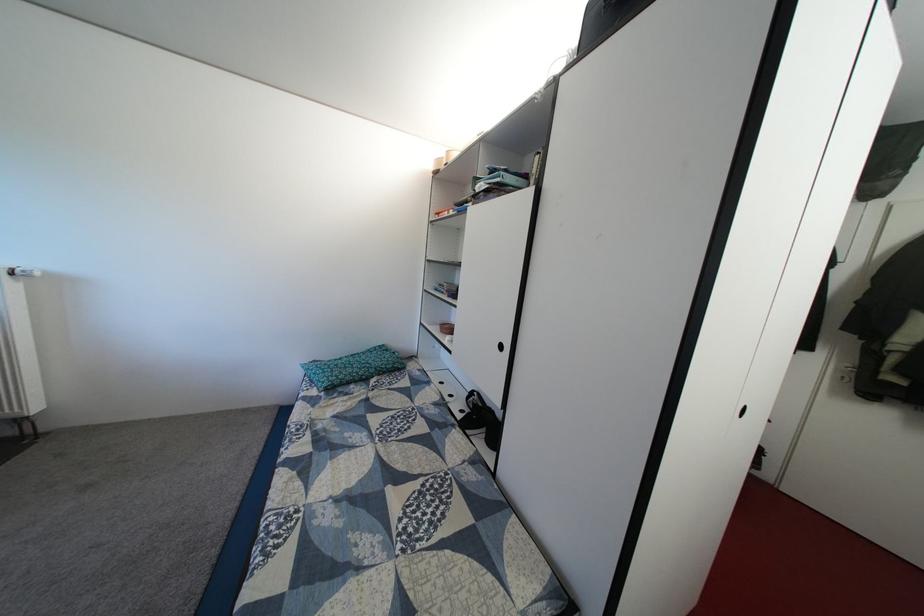
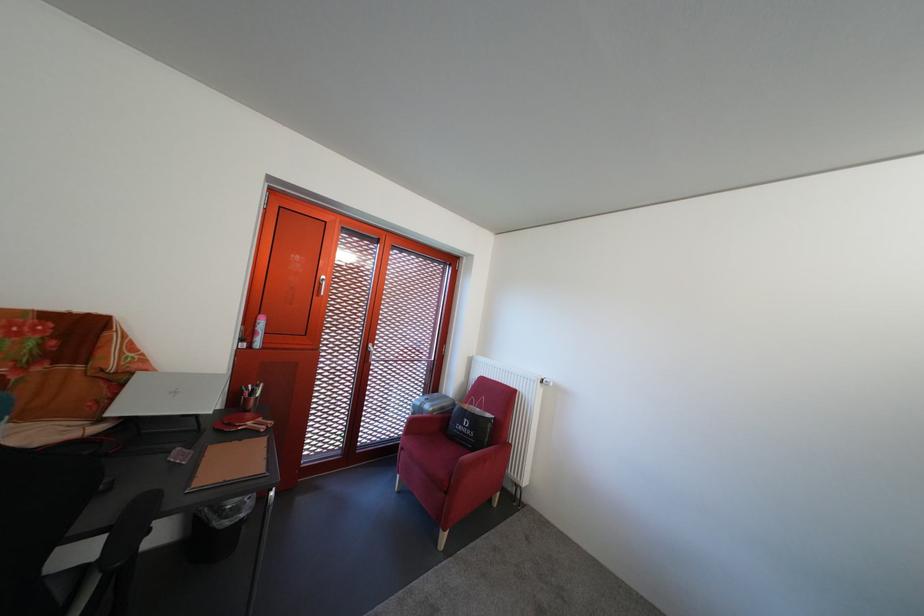
Question: The camera is either moving clockwise (left) or counter-clockwise (right) around the object. The first image is from the beginning of the video and the second image is from the end. Is the camera moving left or right when shooting the video?

Choices:
 (A) Left
 (B) Right

Answer: (B)